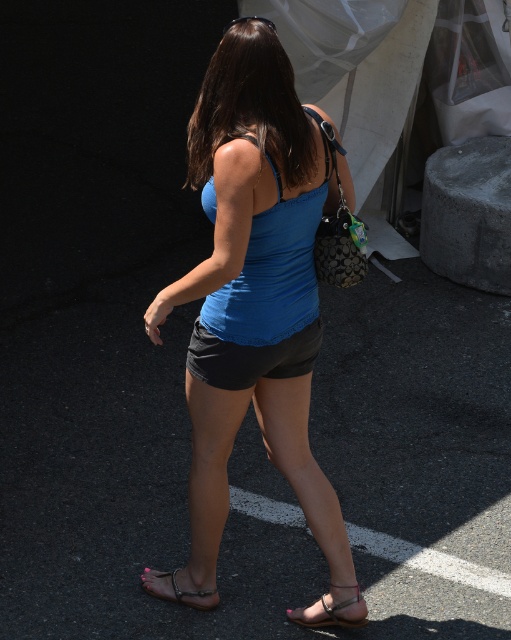
Question: Which of the following is the closest to the observer?

Choices:
 (A) matte blue tank top at center
 (B) brown leather sandal at lower center

Answer: (A)

Question: Is blue matte tank top at center bigger than black cotton shorts at center?

Choices:
 (A) yes
 (B) no

Answer: (A)

Question: Is blue matte tank top at center wider than matte blue tank top at center?

Choices:
 (A) yes
 (B) no

Answer: (A)

Question: Does blue matte tank top at center have a greater width compared to black cotton shorts at center?

Choices:
 (A) yes
 (B) no

Answer: (A)

Question: Which object is the closest to the brown leather sandal at lower center?

Choices:
 (A) pink leather sandal at lower center
 (B) matte blue tank top at center
 (C) black cotton shorts at center
 (D) shiny brown hair at center

Answer: (A)

Question: Which of the following is the farthest from the observer?

Choices:
 (A) black cotton shorts at center
 (B) matte blue tank top at center
 (C) brown leather sandal at lower center

Answer: (C)